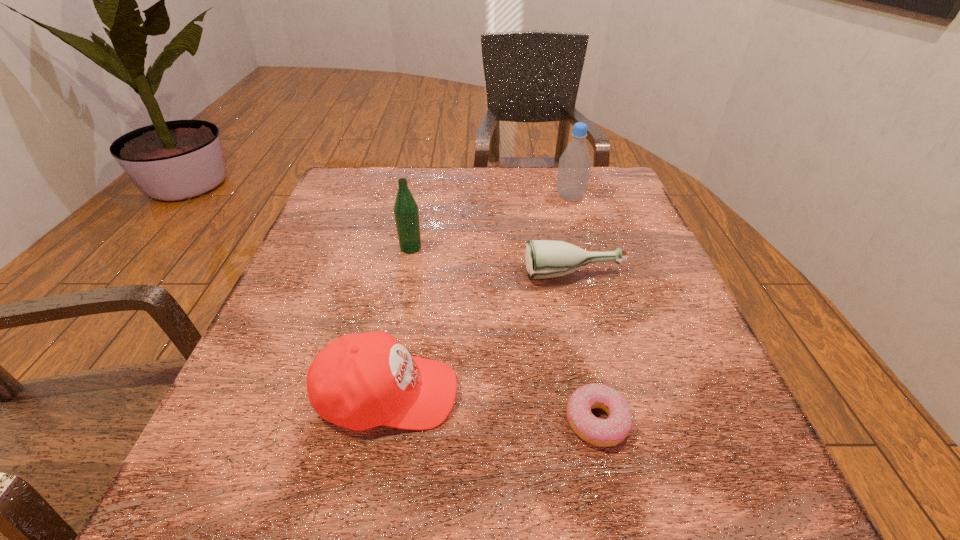
In the image, there is a desktop. Where is `free space at the far right corner`? free space at the far right corner is located at coordinates (615, 194).

Where is `vacant space at the near right corner`? vacant space at the near right corner is located at coordinates (712, 528).

This screenshot has width=960, height=540. I want to click on blank region between the farthest bottle and the nearest bottle, so click(x=572, y=236).

Where is `free spot between the doughnut and the farthest object`? The height and width of the screenshot is (540, 960). free spot between the doughnut and the farthest object is located at coordinates (584, 309).

You are a GUI agent. You are given a task and a screenshot of the screen. Output one action in this format:
    pyautogui.click(x=<x>, y=<y>)
    Task: Click on the free space between the nearest bottle and the second tallest bottle
    Image resolution: width=960 pixels, height=540 pixels.
    Given the screenshot: What is the action you would take?
    pyautogui.click(x=492, y=261)

Where is `free area in between the nearest bottle and the second shortest bottle`? free area in between the nearest bottle and the second shortest bottle is located at coordinates (492, 261).

Where is `vacant space that's between the farthest bottle and the doughnut`? Image resolution: width=960 pixels, height=540 pixels. vacant space that's between the farthest bottle and the doughnut is located at coordinates (584, 309).

Image resolution: width=960 pixels, height=540 pixels. I want to click on free space between the fourth nearest object and the second shortest object, so click(x=492, y=261).

Locate an element on the screen. empty space between the third farthest object and the third shortest object is located at coordinates (481, 334).

Where is `unoccupied position between the shortest object and the second nearest bottle`? This screenshot has width=960, height=540. unoccupied position between the shortest object and the second nearest bottle is located at coordinates (504, 334).